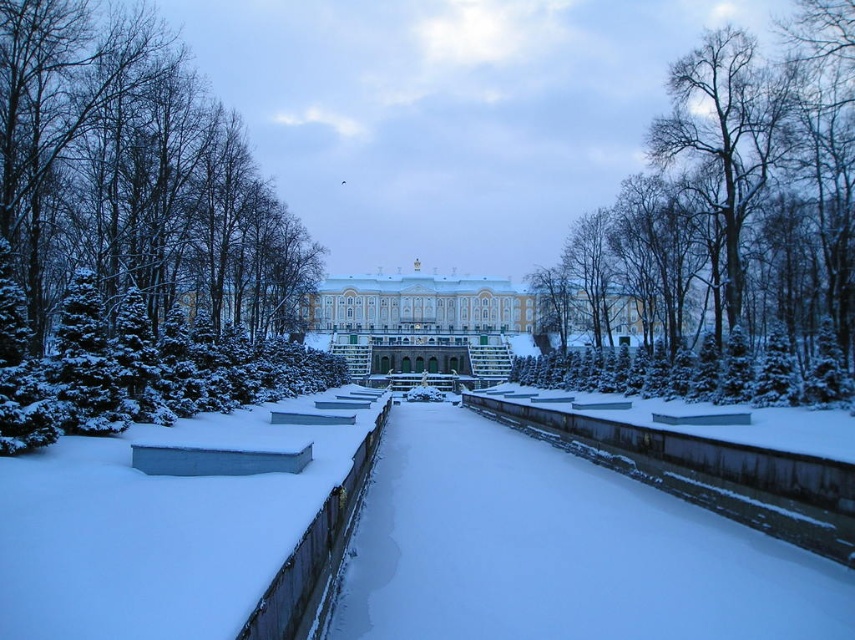
You are an architect analyzing the winter scene. You need to determine which structure is larger between the bare wood tree at upper right and the white stone palace at center. Based on the scene, which one is bigger?

The white stone palace at center is larger than the bare wood tree at upper right.